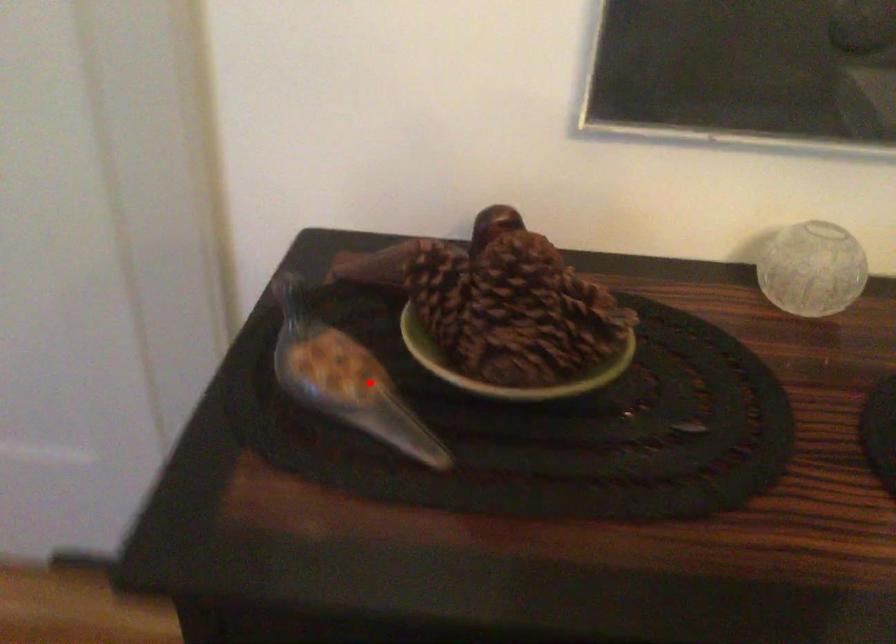
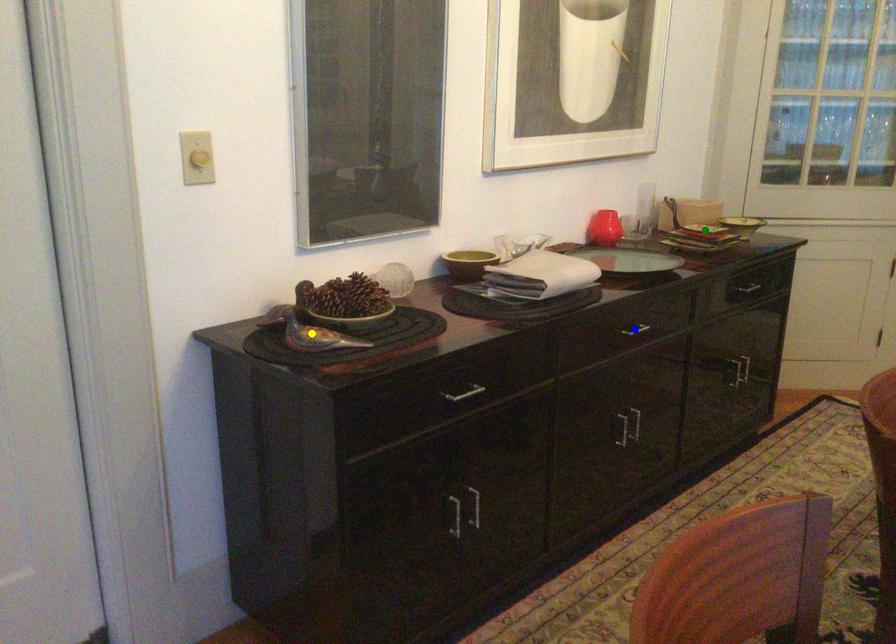
Question: I am providing you with two images of the same scene from different viewpoints. A red point is marked on the first image. You are given multiple points on the second image. Which spot in image 2 lines up with the point in image 1?

Choices:
 (A) yellow point
 (B) green point
 (C) blue point

Answer: (A)